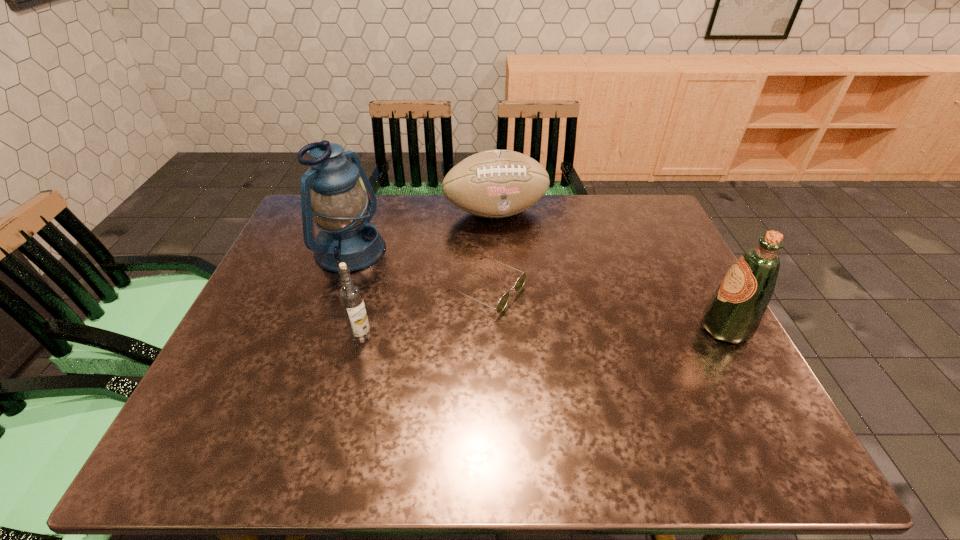
You are a GUI agent. You are given a task and a screenshot of the screen. Output one action in this format:
    pyautogui.click(x=<x>, y=<y>)
    Task: Click on the free point located 0.260m on the front-facing side of the shortest object
    
    Given the screenshot: What is the action you would take?
    click(x=620, y=349)

You are a GUI agent. You are given a task and a screenshot of the screen. Output one action in this format:
    pyautogui.click(x=<x>, y=<y>)
    Task: Click on the vacant point located on the front-facing side of the shortest object
    This screenshot has width=960, height=540.
    Given the screenshot: What is the action you would take?
    pyautogui.click(x=668, y=371)

Locate an element on the screen. vacant region located 0.250m on the front-facing side of the shortest object is located at coordinates (616, 347).

The width and height of the screenshot is (960, 540). Find the location of `vacant space located 0.400m on the face of the lantern`. vacant space located 0.400m on the face of the lantern is located at coordinates click(x=499, y=328).

Identify the location of free location located on the face of the lantern. This screenshot has width=960, height=540. (x=409, y=286).

Identify the location of vacant position located on the face of the lantern. The width and height of the screenshot is (960, 540). (489, 323).

At what (x,y) coordinates should I click in order to perform the action: click on free spot located on the laces of the football (American). Please return your answer as a coordinate pair (x, y). The image size is (960, 540). Looking at the image, I should click on (523, 266).

This screenshot has width=960, height=540. I want to click on vacant area located on the laces of the football (American), so click(543, 315).

The image size is (960, 540). I want to click on vacant region located 0.260m on the laces of the football (American), so click(532, 288).

In order to click on lantern located in the far edge section of the desktop in this screenshot , I will do `click(342, 209)`.